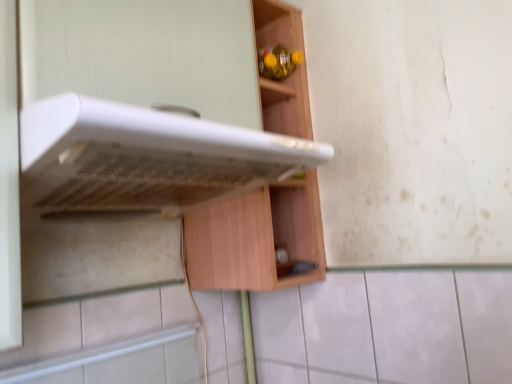
Question: Is point (80, 117) closer or farther from the camera than point (266, 271)?

Choices:
 (A) farther
 (B) closer

Answer: (B)

Question: Is white plastic oven at upper center wider or thinner than wooden cabinet at center?

Choices:
 (A) thin
 (B) wide

Answer: (B)

Question: Relative to wooden cabinet at center, is white plastic oven at upper center in front or behind?

Choices:
 (A) front
 (B) behind

Answer: (A)

Question: Considering the relative positions of wooden cabinet at center and white plastic oven at upper center in the image provided, is wooden cabinet at center to the left or to the right of white plastic oven at upper center?

Choices:
 (A) right
 (B) left

Answer: (A)

Question: Relative to white plastic oven at upper center, is wooden cabinet at center in front or behind?

Choices:
 (A) behind
 (B) front

Answer: (A)

Question: Is point (281, 233) closer or farther from the camera than point (60, 198)?

Choices:
 (A) closer
 (B) farther

Answer: (B)

Question: Do you think wooden cabinet at center is within white plastic oven at upper center, or outside of it?

Choices:
 (A) inside
 (B) outside

Answer: (B)